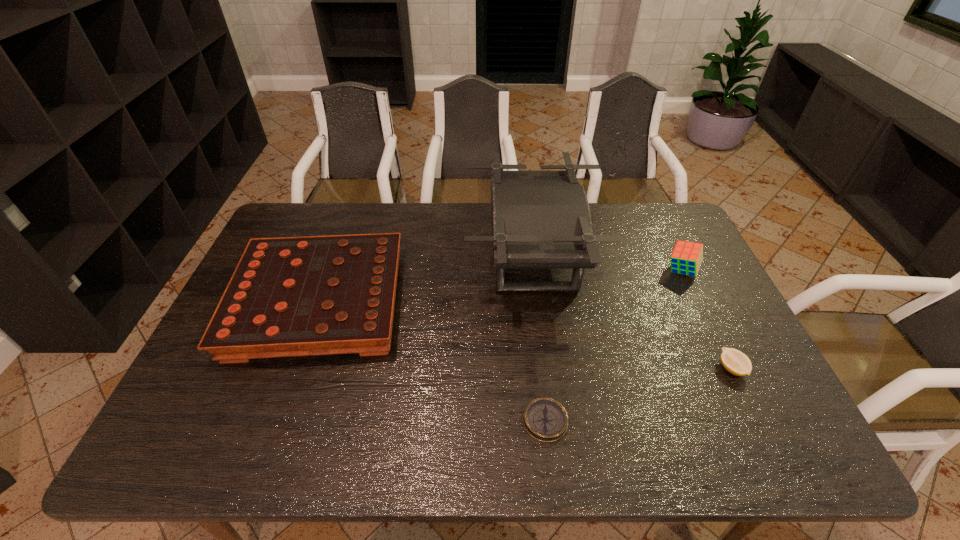
Where is `vacant space that's between the cube and the drone`? The height and width of the screenshot is (540, 960). vacant space that's between the cube and the drone is located at coordinates (607, 265).

You are a GUI agent. You are given a task and a screenshot of the screen. Output one action in this format:
    pyautogui.click(x=<x>, y=<y>)
    Task: Click on the vacant area between the drone and the cube
    Image resolution: width=960 pixels, height=540 pixels.
    Given the screenshot: What is the action you would take?
    pyautogui.click(x=607, y=265)

Where is `free spot between the drone and the fourth tallest object`? This screenshot has width=960, height=540. free spot between the drone and the fourth tallest object is located at coordinates (632, 314).

Where is `unoccupied position between the lemon and the cube`? The height and width of the screenshot is (540, 960). unoccupied position between the lemon and the cube is located at coordinates (707, 320).

The width and height of the screenshot is (960, 540). I want to click on blank region between the nearest object and the tallest object, so click(539, 340).

Find the location of a particular element. empty space between the shortest object and the lemon is located at coordinates (638, 395).

Locate an element on the screen. The image size is (960, 540). object that stands as the closest to the fourth tallest object is located at coordinates (540, 219).

Where is `object that is the second closest to the leftmost object`? The height and width of the screenshot is (540, 960). object that is the second closest to the leftmost object is located at coordinates (545, 419).

Locate an element on the screen. The image size is (960, 540). free space in the image that satisfies the following two spatial constraints: 1. on the back side of the cube; 2. on the left side of the third tallest object is located at coordinates (331, 271).

The image size is (960, 540). What are the coordinates of `free region that satisfies the following two spatial constraints: 1. on the back side of the second shortest object; 2. with a camera mounted on the underside of the drone` in the screenshot? It's located at (678, 259).